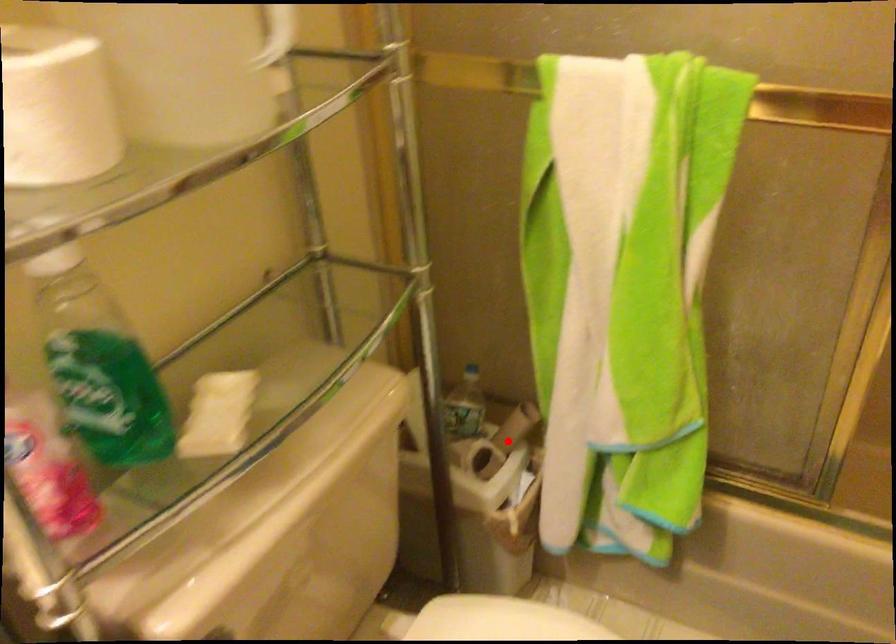
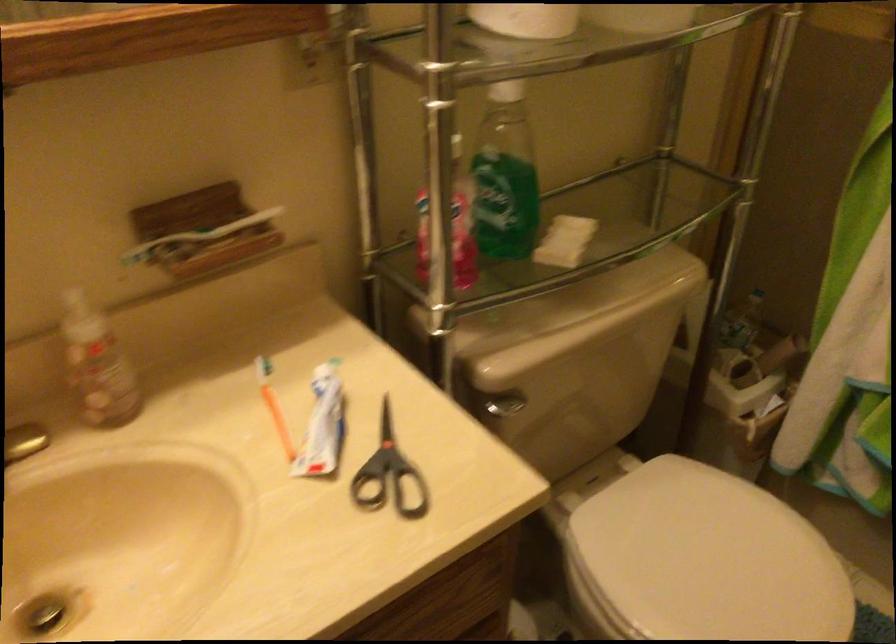
Question: I am providing you with two images of the same scene from different viewpoints. In image1, a red point is highlighted. Considering the same 3D point in image2, which of the following is correct?

Choices:
 (A) It is closer
 (B) It is farther

Answer: (B)